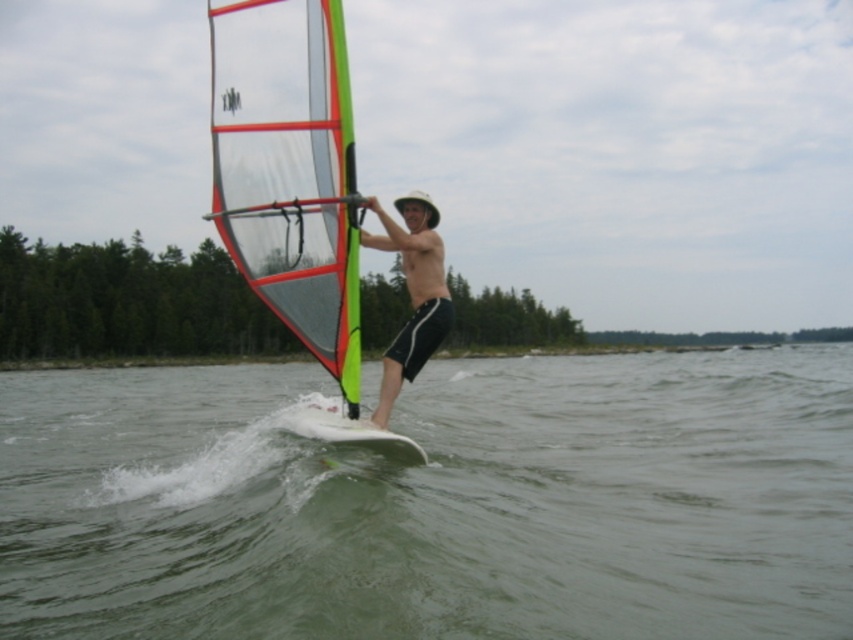
Between transparent plastic sail at center and matte black shorts at center, which one has more height?

With more height is transparent plastic sail at center.

Which is in front, point (235, 209) or point (418, 243)?

Point (418, 243) is in front.

Is point (230, 113) behind point (436, 296)?

Yes, it is.

I want to click on transparent plastic sail at center, so click(x=289, y=170).

Looking at this image, who is positioned more to the left, greenish-gray water at center or transparent plastic sail at center?

transparent plastic sail at center

This screenshot has width=853, height=640. What do you see at coordinates (434, 500) in the screenshot?
I see `greenish-gray water at center` at bounding box center [434, 500].

At what (x,y) coordinates should I click in order to perform the action: click on greenish-gray water at center. Please return your answer as a coordinate pair (x, y). The image size is (853, 640). Looking at the image, I should click on (434, 500).

Who is more forward, (338, 104) or (286, 413)?

Positioned in front is point (338, 104).

Does transparent plastic sail at center come in front of white smooth surfboard at center?

No, it is not.

Between point (248, 280) and point (368, 438), which one is positioned behind?

The point (248, 280) is more distant.

Locate an element on the screen. The height and width of the screenshot is (640, 853). transparent plastic sail at center is located at coordinates (289, 170).